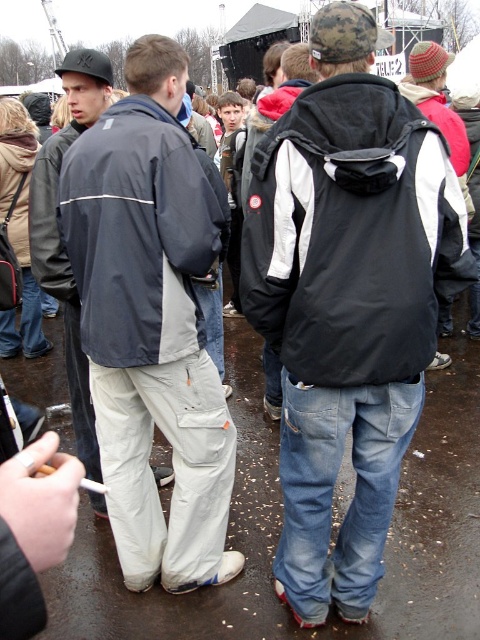
Question: Which object appears farthest from the camera in this image?

Choices:
 (A) black/white jacket at center
 (B) matte gray jacket at center

Answer: (B)

Question: Is dark gray matte jacket at center behind matte black jacket at center?

Choices:
 (A) yes
 (B) no

Answer: (B)

Question: Which object appears closest to the camera in this image?

Choices:
 (A) matte black jacket at left
 (B) black/white jacket at center
 (C) matte gray jacket at center
 (D) matte black jacket at center

Answer: (B)

Question: Among these points, which one is farthest from the camera?

Choices:
 (A) (68, 138)
 (B) (285, 250)

Answer: (A)

Question: Is black/white jacket at center smaller than matte black jacket at center?

Choices:
 (A) no
 (B) yes

Answer: (A)

Question: Can you confirm if black/white jacket at center is thinner than matte black jacket at left?

Choices:
 (A) no
 (B) yes

Answer: (A)